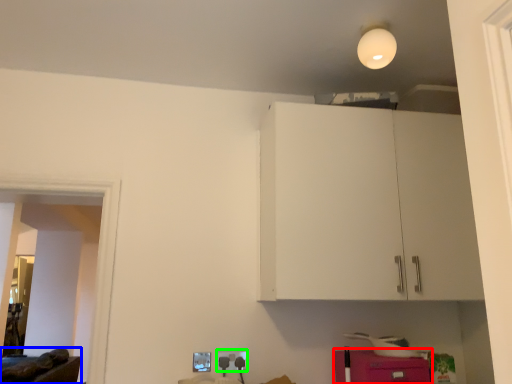
Question: Based on their relative distances, which object is nearer to cabinetry (highlighted by a red box)? Choose from furniture (highlighted by a blue box) and electric outlet (highlighted by a green box).

Choices:
 (A) furniture
 (B) electric outlet

Answer: (B)